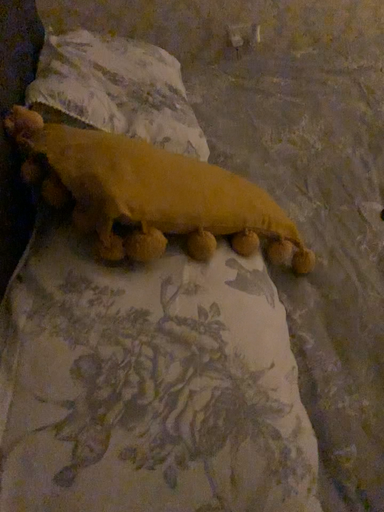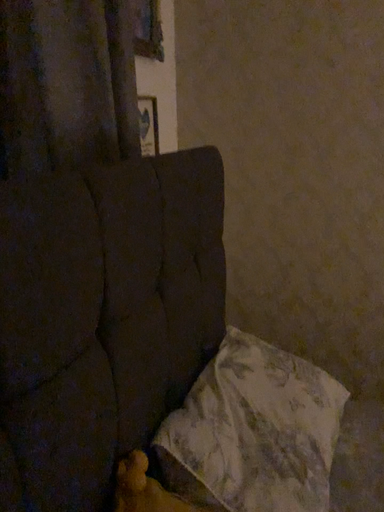
Question: Which way did the camera rotate in the video?

Choices:
 (A) rotated left
 (B) rotated right

Answer: (A)